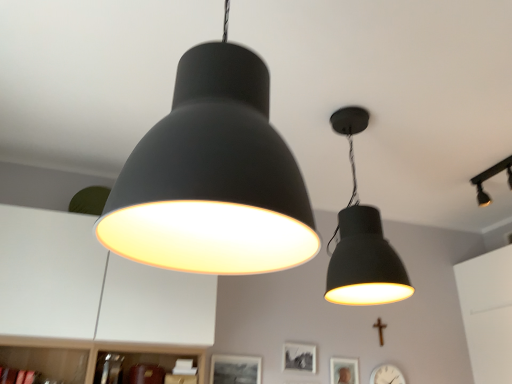
Question: Is matte black track light at upper right, the 1th lamp positioned from the back, inside or outside of matte black picture frame at lower center, the 1th picture frame viewed from the left?

Choices:
 (A) outside
 (B) inside

Answer: (A)

Question: Considering the positions of matte black track light at upper right, the 3th lamp viewed from the left, and matte black picture frame at lower center, the 1th picture frame viewed from the left, in the image, is matte black track light at upper right, the 3th lamp viewed from the left, bigger or smaller than matte black picture frame at lower center, the 1th picture frame viewed from the left,?

Choices:
 (A) big
 (B) small

Answer: (A)

Question: Estimate the real-world distances between objects in this image. Which object is farther from the matte black picture frame at center, the 2th picture frame in the right-to-left sequence?

Choices:
 (A) gold metallic crucifix at lower right
 (B) white glossy dresser at lower left
 (C) matte black picture frame at lower center, the 1th picture frame viewed from the left
 (D) matte black lampshade at upper right, the 2th lamp in the right-to-left sequence
 (E) matte black lampshade at upper center, which is the 3th lamp from right to left

Answer: (E)

Question: Based on their relative distances, which object is farther from the matte black lampshade at upper right, positioned as the 2th lamp in left-to-right order?

Choices:
 (A) matte black picture frame at center, the 2th picture frame in the right-to-left sequence
 (B) matte black picture frame at lower center, the 1th picture frame viewed from the left
 (C) matte black picture frame at lower center, placed as the 3th picture frame when sorted from left to right
 (D) matte black track light at upper right, the 1th lamp positioned from the back
 (E) white glossy dresser at lower left

Answer: (D)